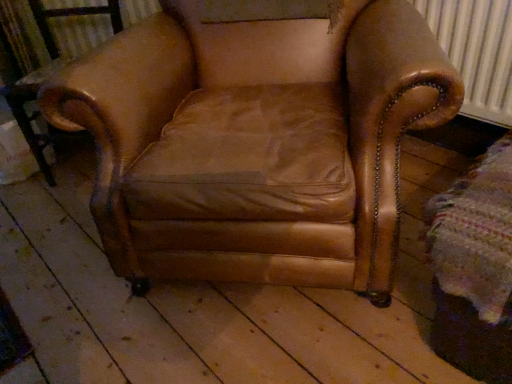
The image size is (512, 384). In order to click on vacant area that lies in front of metallic black side table at left in this screenshot , I will do `click(25, 215)`.